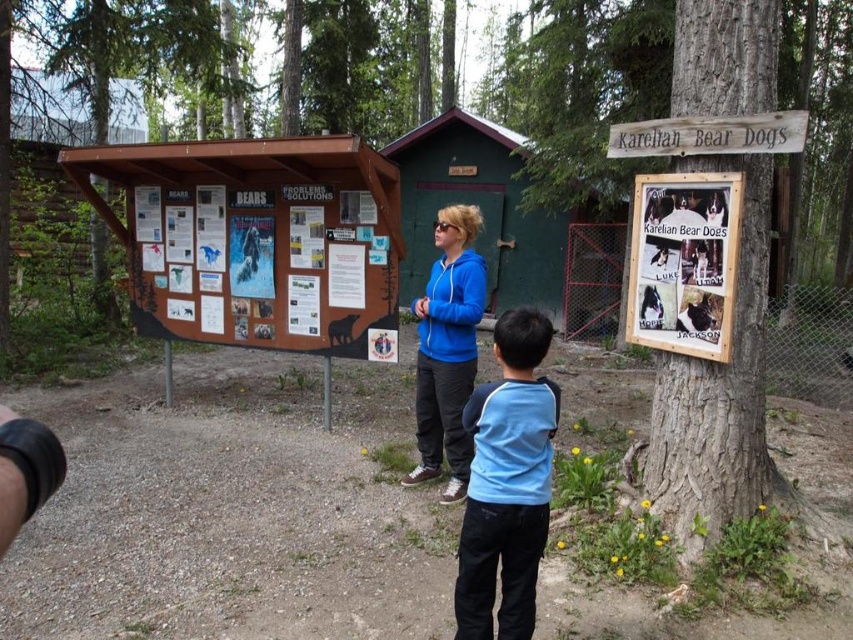
Question: Does printed paper posters at left have a larger size compared to wooden signboard at upper right?

Choices:
 (A) no
 (B) yes

Answer: (B)

Question: Does green wooden hut at center appear on the right side of wooden sign at upper right?

Choices:
 (A) no
 (B) yes

Answer: (A)

Question: Among these points, which one is farthest from the camera?

Choices:
 (A) (647, 243)
 (B) (624, 136)

Answer: (B)

Question: Which of the following is the closest to the observer?

Choices:
 (A) blue fleece jacket at center
 (B) wooden sign at upper right
 (C) wooden signboard at upper right
 (D) blue cotton shirt at center

Answer: (D)

Question: Which object is positioned farthest from the wooden sign at upper right?

Choices:
 (A) wooden signboard at upper right
 (B) printed paper posters at left
 (C) blue cotton shirt at center
 (D) blue fleece jacket at center

Answer: (B)

Question: Can you confirm if blue fleece jacket at center is bigger than wooden sign at upper right?

Choices:
 (A) yes
 (B) no

Answer: (A)